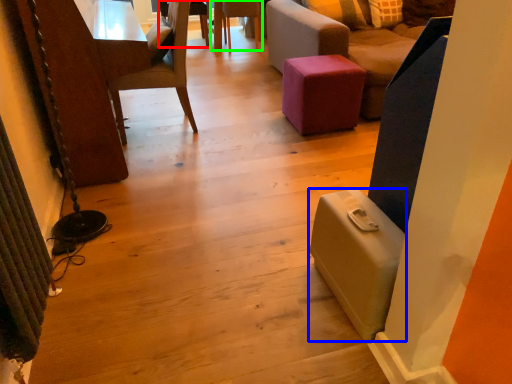
Question: Which object is the closest to the chair (highlighted by a red box)? Choose among these: luggage (highlighted by a blue box) or chair (highlighted by a green box).

Choices:
 (A) luggage
 (B) chair

Answer: (B)